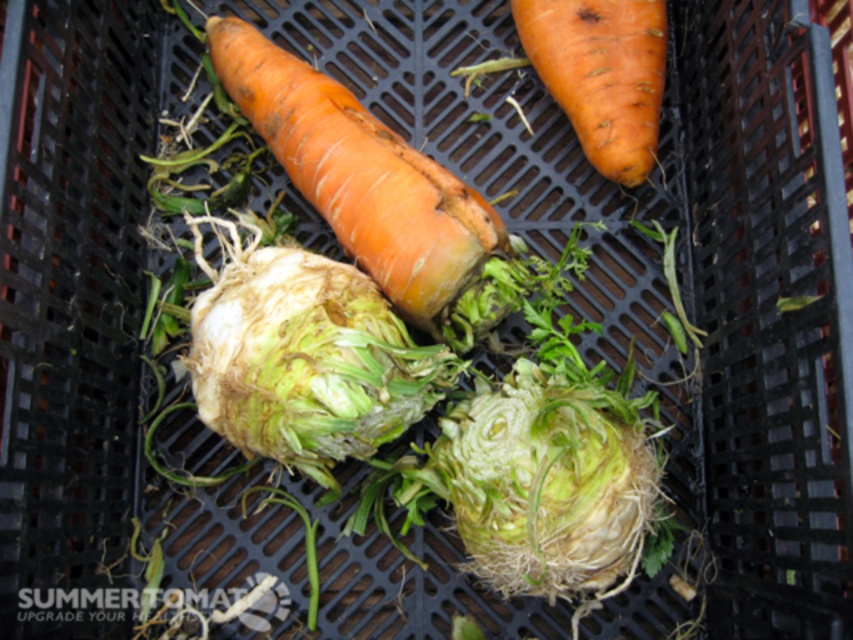
Question: Does green fibrous cabbage at center appear over orange rough carrot at center?

Choices:
 (A) yes
 (B) no

Answer: (B)

Question: Estimate the real-world distances between objects in this image. Which object is farther from the orange rough carrot at center?

Choices:
 (A) green fibrous cabbage at center
 (B) orange rough carrot at upper right
 (C) green leafy celeriac at center

Answer: (B)

Question: Is the position of green leafy celeriac at center more distant than that of orange rough carrot at center?

Choices:
 (A) yes
 (B) no

Answer: (B)

Question: Estimate the real-world distances between objects in this image. Which object is closer to the green leafy celeriac at center?

Choices:
 (A) orange rough carrot at upper right
 (B) orange rough carrot at center
 (C) green fibrous cabbage at center

Answer: (B)

Question: Which of the following is the farthest from the observer?

Choices:
 (A) green fibrous cabbage at center
 (B) orange rough carrot at center
 (C) green leafy celeriac at center
 (D) orange rough carrot at upper right

Answer: (D)

Question: Can you confirm if green leafy celeriac at center is smaller than green fibrous cabbage at center?

Choices:
 (A) yes
 (B) no

Answer: (B)